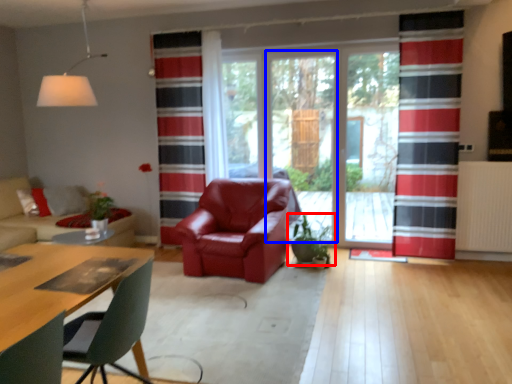
Question: Which object is closer to the camera taking this photo, houseplant (highlighted by a red box) or screen door (highlighted by a blue box)?

Choices:
 (A) houseplant
 (B) screen door

Answer: (A)